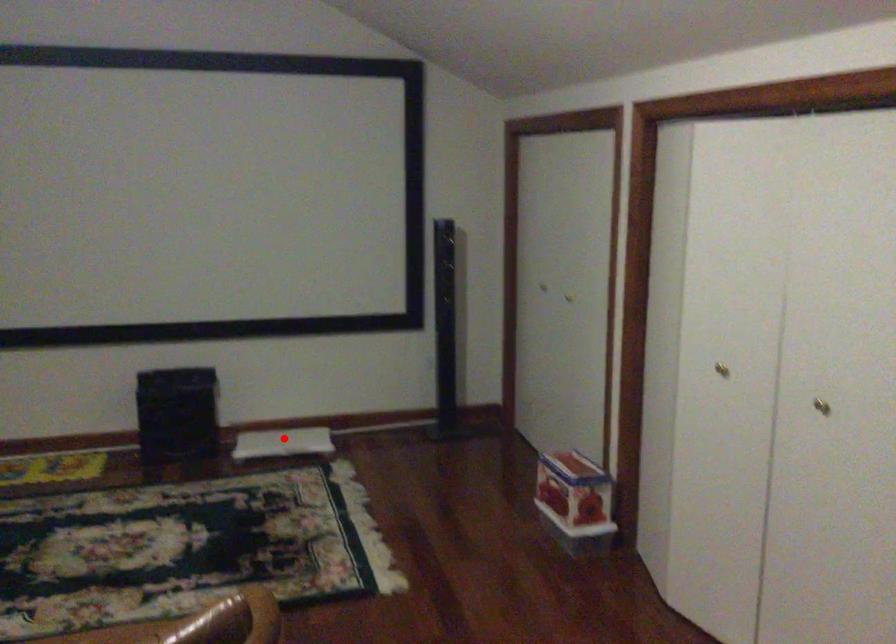
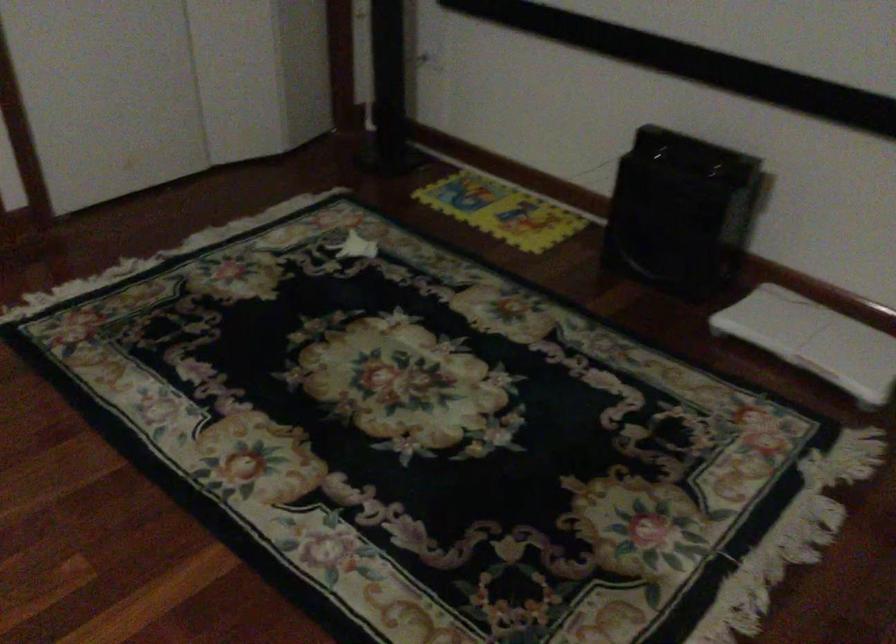
Question: I am providing you with two images of the same scene from different viewpoints. Image1 has a red point marked. In image2, the corresponding 3D location appears at what relative position? Reply with the corresponding letter.

Choices:
 (A) Closer
 (B) Farther

Answer: (A)